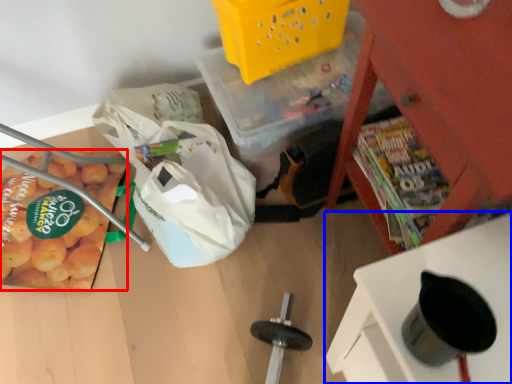
Question: Which object appears farthest to the camera in this image, vegetable (highlighted by a red box) or furniture (highlighted by a blue box)?

Choices:
 (A) vegetable
 (B) furniture

Answer: (A)